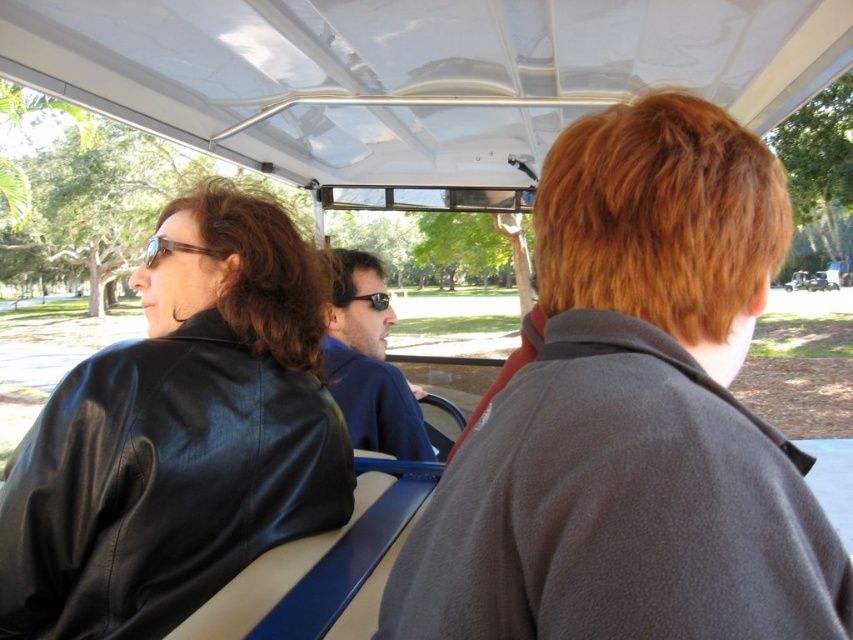
You are a passenger in the vehicle and want to place a small backpack on the seat. The seat has a blue bench seat. Where should you place the backpack so it doesn not interfere with the gray fleece jacket at center?

The gray fleece jacket at center is located at point (633,417). To avoid interference, place the backpack away from that coordinate on the blue bench seat.

You are standing outside the vehicle and looking through the window. You see a point marked at coordinates (x=368, y=364). Which object does this point correspond to?

The point at coordinates (x=368, y=364) corresponds to the blue leather jacket at center.